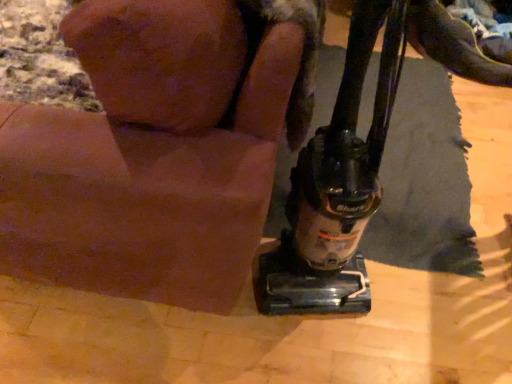
This screenshot has height=384, width=512. In order to click on free space in front of black plastic vacuum cleaner at lower right in this screenshot , I will do `click(318, 356)`.